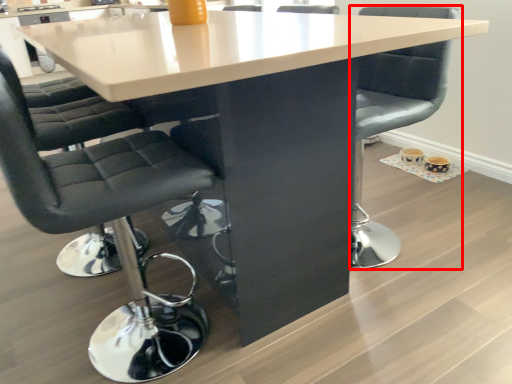
Question: In this image, where is chair (annotated by the red box) located relative to chair?

Choices:
 (A) left
 (B) right

Answer: (B)